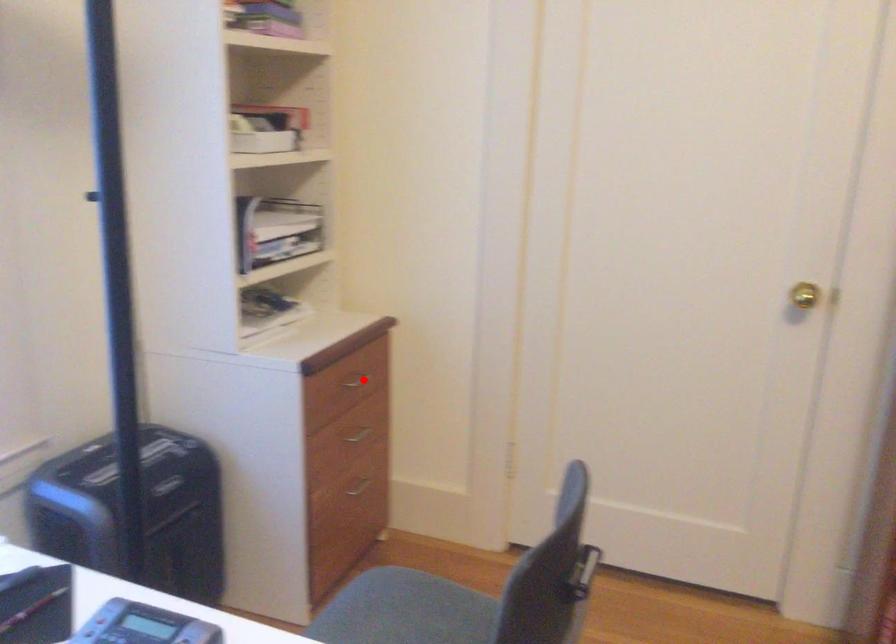
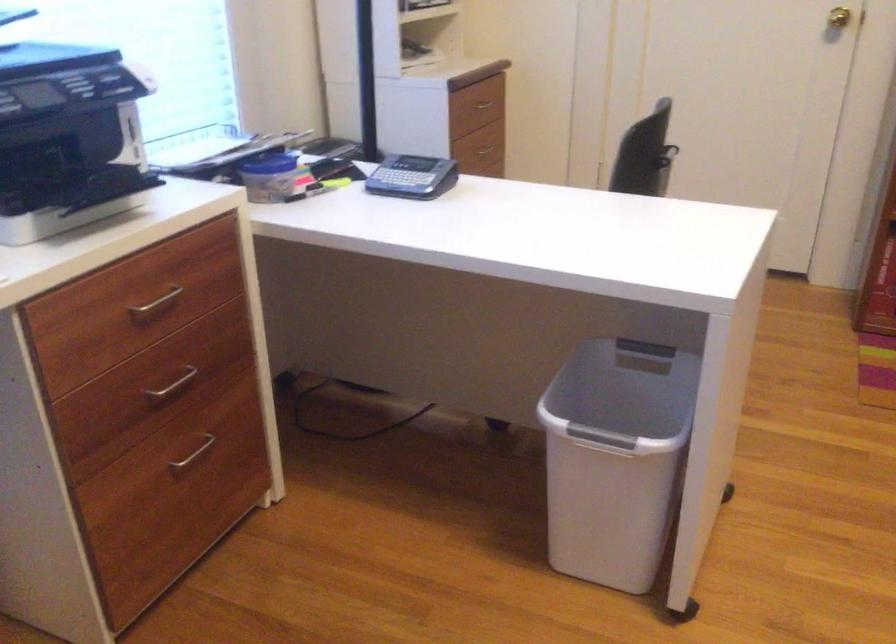
Locate, in the second image, the point that corresponds to the highlighted location in the first image.

(484, 104)